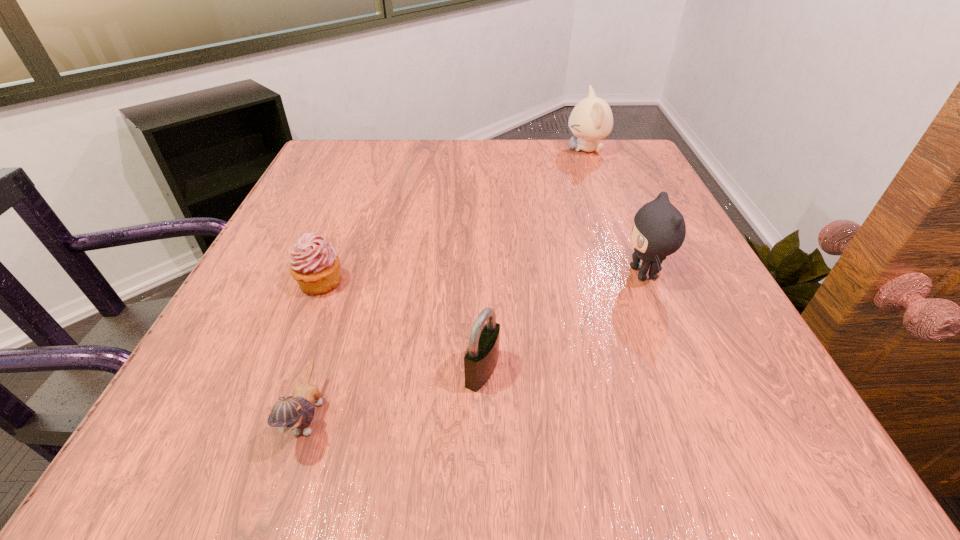
Locate an element on the screen. The width and height of the screenshot is (960, 540). the farthest kitten is located at coordinates (591, 119).

Locate an element on the screen. This screenshot has height=540, width=960. the second nearest kitten is located at coordinates (659, 229).

You are a GUI agent. You are given a task and a screenshot of the screen. Output one action in this format:
    pyautogui.click(x=<x>, y=<y>)
    Task: Click on the third object from left to right
    
    Given the screenshot: What is the action you would take?
    pyautogui.click(x=481, y=357)

Identify the location of the fourth tallest object. The height and width of the screenshot is (540, 960). (315, 265).

You are a GUI agent. You are given a task and a screenshot of the screen. Output one action in this format:
    pyautogui.click(x=<x>, y=<y>)
    Task: Click on the leftmost kitten
    The height and width of the screenshot is (540, 960).
    Given the screenshot: What is the action you would take?
    pyautogui.click(x=296, y=413)

The width and height of the screenshot is (960, 540). Identify the location of the nearest kitten. click(296, 413).

Find the location of `blank space located on the face of the farthest object`. blank space located on the face of the farthest object is located at coordinates (519, 150).

This screenshot has height=540, width=960. I want to click on vacant space located 0.160m on the face of the farthest object, so click(x=504, y=150).

Image resolution: width=960 pixels, height=540 pixels. I want to click on blank space located on the face of the farthest object, so click(542, 150).

This screenshot has width=960, height=540. What are the coordinates of `vacant space located 0.170m on the front-facing side of the second nearest kitten` in the screenshot? It's located at (527, 273).